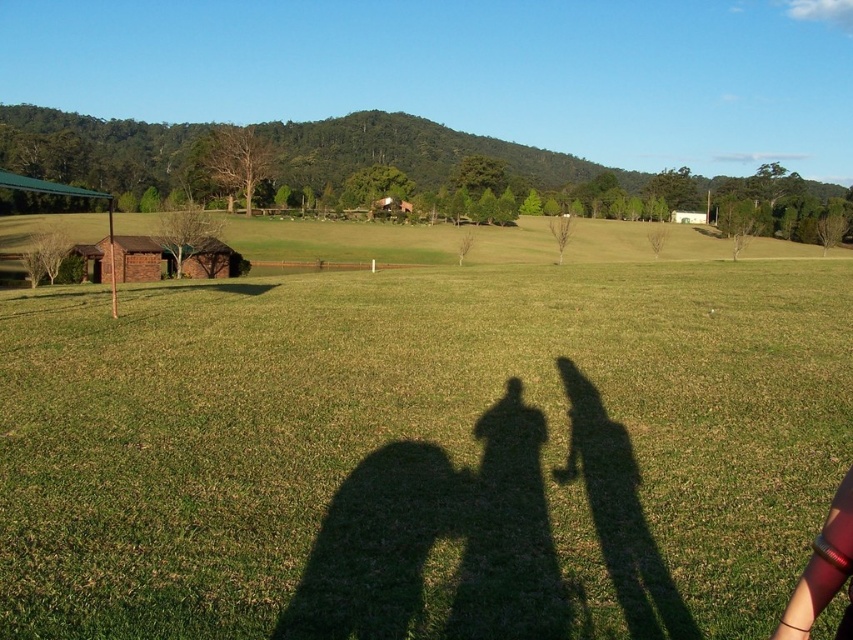
Can you confirm if green grass at center is bigger than red fabric arm at lower right?

Correct, green grass at center is larger in size than red fabric arm at lower right.

Can you confirm if green grass at center is shorter than red fabric arm at lower right?

No.

Is point (611, 291) behind point (849, 632)?

Yes, point (611, 291) is farther from viewer.

Identify the location of green grass at center. This screenshot has height=640, width=853. (426, 442).